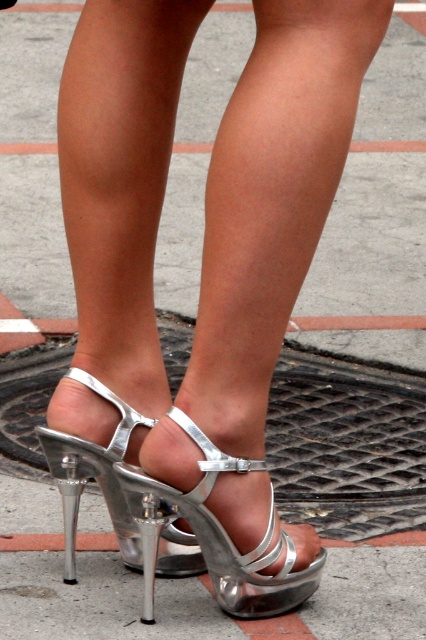
Between shiny metallic high-heeled shoe at center and shiny metallic heel at center, which one is positioned higher?

shiny metallic high-heeled shoe at center is above.

Does shiny metallic high-heeled shoe at center have a smaller size compared to shiny metallic heel at center?

No, shiny metallic high-heeled shoe at center is not smaller than shiny metallic heel at center.

The width and height of the screenshot is (426, 640). Find the location of `shiny metallic high-heeled shoe at center`. shiny metallic high-heeled shoe at center is located at coordinates (221, 532).

Does shiny metallic sandal at lower center have a lesser width compared to shiny metallic heel at center?

No, shiny metallic sandal at lower center is not thinner than shiny metallic heel at center.

Is shiny metallic sandal at lower center positioned at the back of shiny metallic heel at center?

No.

Who is more forward, [164,522] or [74,579]?

Point [164,522] is in front.

Image resolution: width=426 pixels, height=640 pixels. I want to click on shiny metallic sandal at lower center, so click(x=117, y=497).

Is shiny metallic high-heeled shoe at center positioned behind shiny metallic sandal at lower center?

No, shiny metallic high-heeled shoe at center is closer to the viewer.

Between shiny metallic high-heeled shoe at center and shiny metallic sandal at lower center, which one has less height?

With less height is shiny metallic high-heeled shoe at center.

Does point (150, 486) come behind point (104, 385)?

No, it is in front of (104, 385).

Identify the location of shiny metallic high-heeled shoe at center. (221, 532).